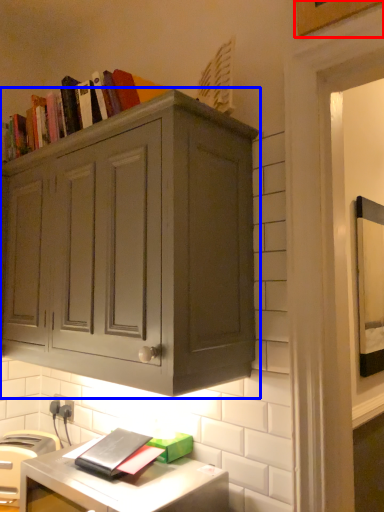
Question: Among these objects, which one is nearest to the camera, picture frame (highlighted by a red box) or cabinetry (highlighted by a blue box)?

Choices:
 (A) picture frame
 (B) cabinetry

Answer: (B)